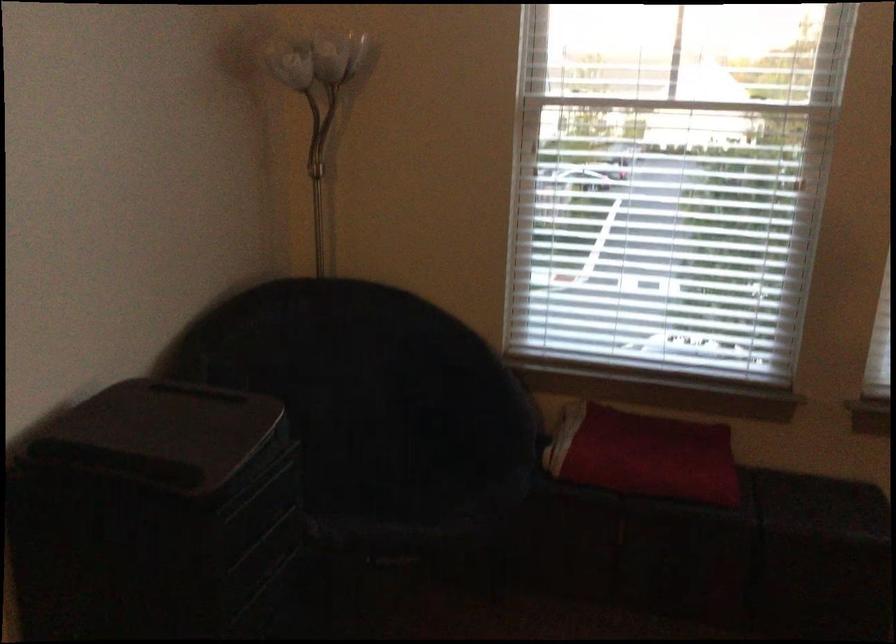
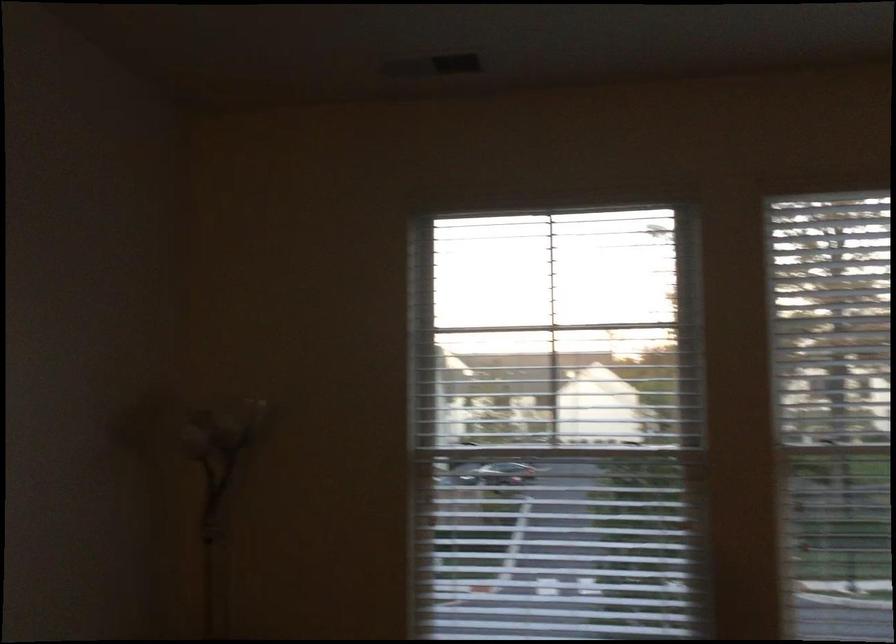
The images are taken continuously from a first-person perspective. In which direction are you moving?

The movement direction of the cameraman is right, backward.